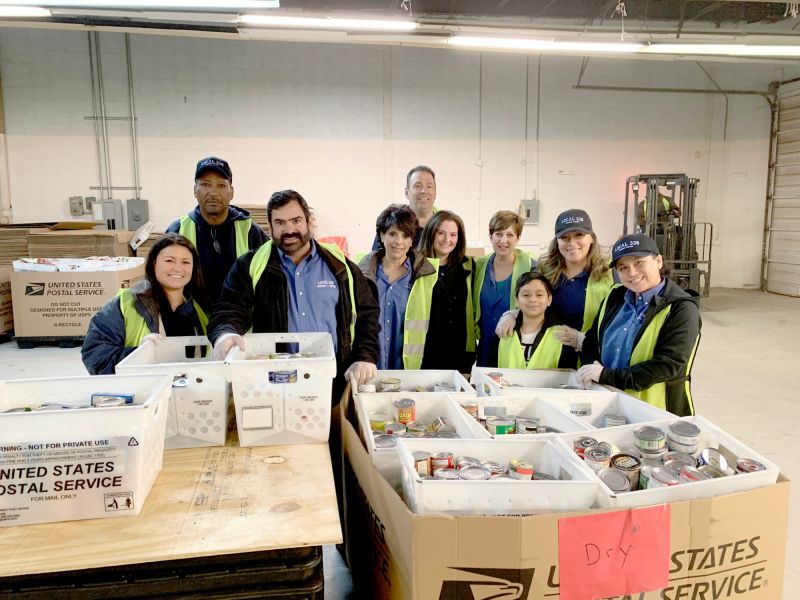
Where is `lights`? Image resolution: width=800 pixels, height=600 pixels. lights is located at coordinates (30, 11), (338, 22), (494, 40), (718, 48).